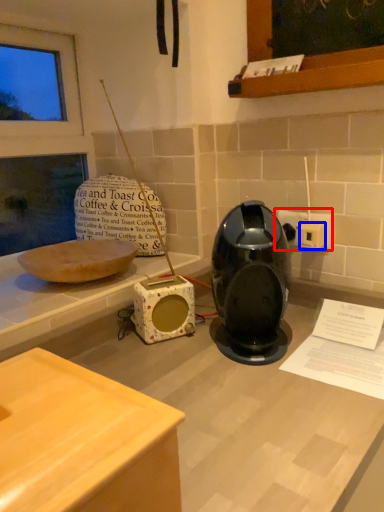
Question: Which point is closer to the camera, electric outlet (highlighted by a red box) or electric outlet (highlighted by a blue box)?

Choices:
 (A) electric outlet
 (B) electric outlet

Answer: (B)